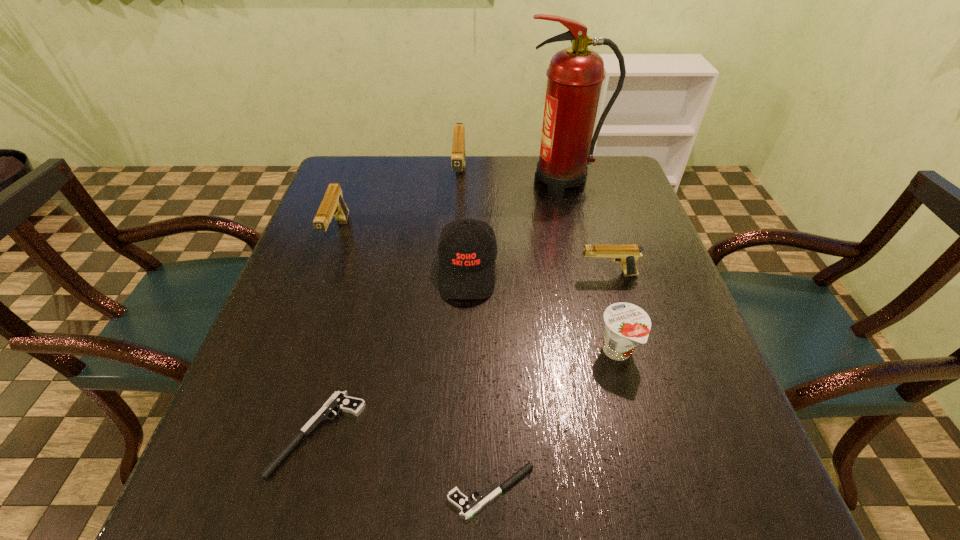
This screenshot has width=960, height=540. I want to click on vacant area situated 0.380m on the left of the yogurt, so click(400, 352).

Where is `free region located at the barrel of the rightmost pistol`? The height and width of the screenshot is (540, 960). free region located at the barrel of the rightmost pistol is located at coordinates (408, 274).

The height and width of the screenshot is (540, 960). In order to click on free spot located at the barrel of the rightmost pistol in this screenshot , I will do `click(482, 274)`.

Find the location of `blank area located 0.190m at the barrel of the rightmost pistol`. blank area located 0.190m at the barrel of the rightmost pistol is located at coordinates (495, 274).

At what (x,y) coordinates should I click in order to perform the action: click on vacant space located 0.090m on the front-facing side of the fourth tallest pistol. Please return your answer as a coordinate pair (x, y). This screenshot has width=960, height=540. Looking at the image, I should click on (223, 434).

At what (x,y) coordinates should I click in order to perform the action: click on free space located on the front-facing side of the shortest pistol. Please return your answer as a coordinate pair (x, y). The image size is (960, 540). Looking at the image, I should click on (415, 491).

Locate an element on the screen. This screenshot has height=540, width=960. vacant space located on the front-facing side of the shortest pistol is located at coordinates (344, 491).

What are the coordinates of `vacant space located on the front-facing side of the shortest pistol` in the screenshot? It's located at coord(226,491).

I want to click on fire extinguisher that is at the far edge, so click(x=575, y=75).

At what (x,y) coordinates should I click in order to perform the action: click on pistol located in the far edge section of the desktop. Please return your answer as a coordinate pair (x, y). This screenshot has width=960, height=540. Looking at the image, I should click on (458, 160).